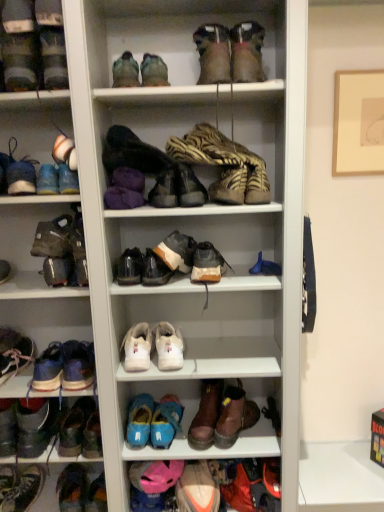
Question: Considering the relative positions of matte black shoe at upper left, arranged as the 4th shoe when viewed from the top, and shiny black shoe at lower left, the 18th shoe when ordered from top to bottom, in the image provided, is matte black shoe at upper left, arranged as the 4th shoe when viewed from the top, to the left or to the right of shiny black shoe at lower left, the 18th shoe when ordered from top to bottom,?

Choices:
 (A) right
 (B) left

Answer: (A)

Question: Considering the positions of matte black shoe at upper left, arranged as the 4th shoe when viewed from the top, and shiny black shoe at lower left, the 18th shoe when ordered from top to bottom, in the image, is matte black shoe at upper left, arranged as the 4th shoe when viewed from the top, bigger or smaller than shiny black shoe at lower left, the 18th shoe when ordered from top to bottom,?

Choices:
 (A) big
 (B) small

Answer: (B)

Question: Which object is positioned farthest from the matte gray boot at upper left, the 5th footwear in the bottom-to-top sequence?

Choices:
 (A) leather/textured boot at center, which appears as the fifth footwear when viewed from the left
 (B) leather at center, which ranks as the 10th shoe in bottom-to-top order
 (C) white matte shoe at upper left, which ranks as the 17th shoe in bottom-to-top order
 (D) brown suede sneaker at center, acting as the 7th shoe starting from the top
 (E) multicolored fabric shoe at lower left, positioned as the second shoe in bottom-to-top order

Answer: (E)

Question: Estimate the real-world distances between objects in this image. Which object is farther from the blue suede shoes at center, acting as the sixth shoe starting from the bottom?

Choices:
 (A) orange suede sneaker at lower center, the sixteenth shoe when ordered from top to bottom
 (B) leather boot at upper center, which is the 18th shoe from bottom to top
 (C) leather boot at lower left, acting as the first footwear starting from the bottom
 (D) matte blue shoe at left, the 14th shoe from the bottom
 (E) brown leather boot at lower center, which is the seventh shoe from bottom to top

Answer: (B)